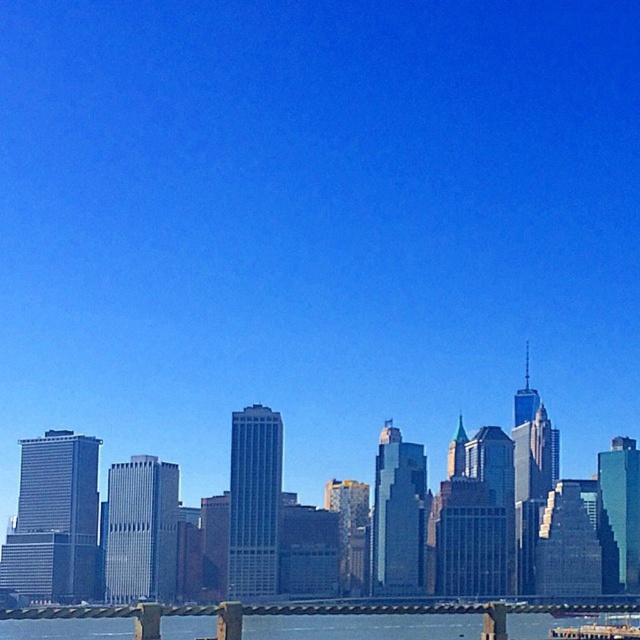
Question: Does clear water at lower center have a lesser width compared to metallic ferry at lower center?

Choices:
 (A) no
 (B) yes

Answer: (A)

Question: Which of the following is the closest to the observer?

Choices:
 (A) clear water at lower center
 (B) metallic ferry at lower center

Answer: (A)

Question: Does clear water at lower center appear over metallic ferry at lower center?

Choices:
 (A) no
 (B) yes

Answer: (B)

Question: Can you confirm if clear water at lower center is wider than metallic ferry at lower center?

Choices:
 (A) no
 (B) yes

Answer: (B)